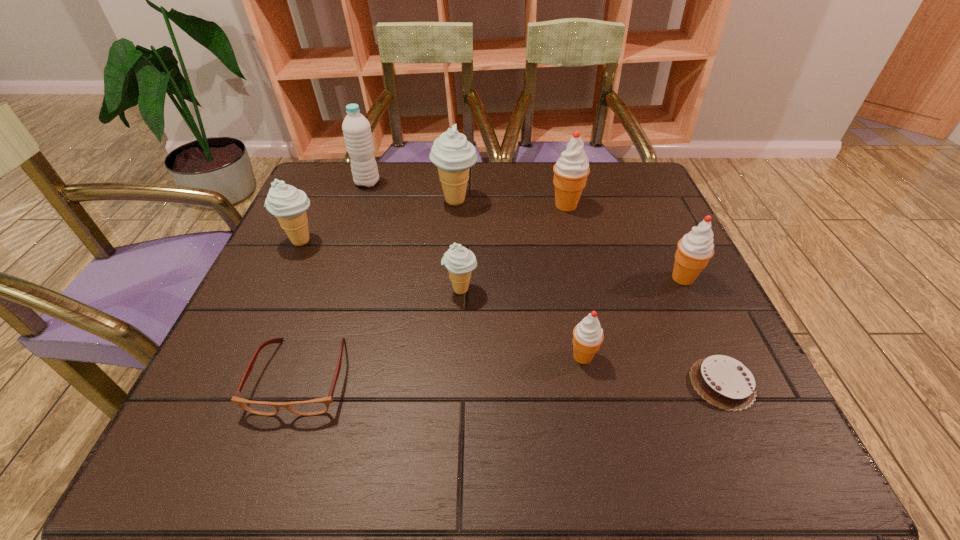
You are a GUI agent. You are given a task and a screenshot of the screen. Output one action in this format:
    pyautogui.click(x=<x>, y=<y>)
    Task: Click on the blank region between the nearest icecream and the fourth nearest icecream
    This screenshot has width=960, height=540.
    Given the screenshot: What is the action you would take?
    pyautogui.click(x=442, y=299)

At what (x,y) coordinates should I click in order to perform the action: click on free space between the farthest red icecream and the smallest red icecream. Please return your answer as a coordinate pair (x, y). This screenshot has width=960, height=540. Looking at the image, I should click on (574, 281).

At what (x,y) coordinates should I click in order to perform the action: click on free spot between the nearest icecream and the water bottle. Please return your answer as a coordinate pair (x, y). Looking at the image, I should click on (475, 269).

Where is `free space between the nearest beige icecream and the brown spectacles`? Image resolution: width=960 pixels, height=540 pixels. free space between the nearest beige icecream and the brown spectacles is located at coordinates (381, 333).

You are a GUI agent. You are given a task and a screenshot of the screen. Output one action in this format:
    pyautogui.click(x=<x>, y=<y>)
    Task: Click on the free spot between the chocolate cake and the farthest beige icecream
    The width and height of the screenshot is (960, 540).
    Given the screenshot: What is the action you would take?
    pyautogui.click(x=588, y=292)

Identify the location of object that can be found as the closest to the second shortest object. The image size is (960, 540). (459, 261).

The height and width of the screenshot is (540, 960). In order to click on the third closest object to the water bottle in this screenshot , I will do `click(459, 261)`.

Select which icecream is the sixth closest to the shortest object. Please provide its 2D coordinates. Your answer should be formatted as a tuple, i.e. [(x, y)], where the tuple contains the x and y coordinates of a point satisfying the conditions above.

[(288, 204)]

Point out which icecream is positioned as the fourth nearest to the nearest beige icecream. Please provide its 2D coordinates. Your answer should be formatted as a tuple, i.e. [(x, y)], where the tuple contains the x and y coordinates of a point satisfying the conditions above.

[(288, 204)]

Image resolution: width=960 pixels, height=540 pixels. Find the location of `red icecream object that ranks as the third closest to the smallest beige icecream`. red icecream object that ranks as the third closest to the smallest beige icecream is located at coordinates (694, 250).